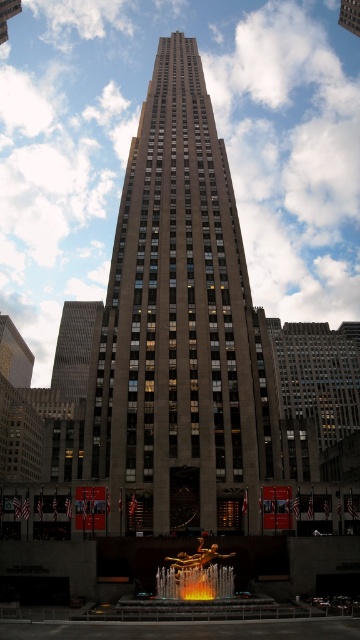
Based on the photo, does brown stone tower at center have a greater height compared to dark gray stone tower at left?

Yes.

Is point (227, 420) more distant than point (65, 381)?

That is False.

Where is `brown stone tower at center`? The image size is (360, 640). brown stone tower at center is located at coordinates (178, 328).